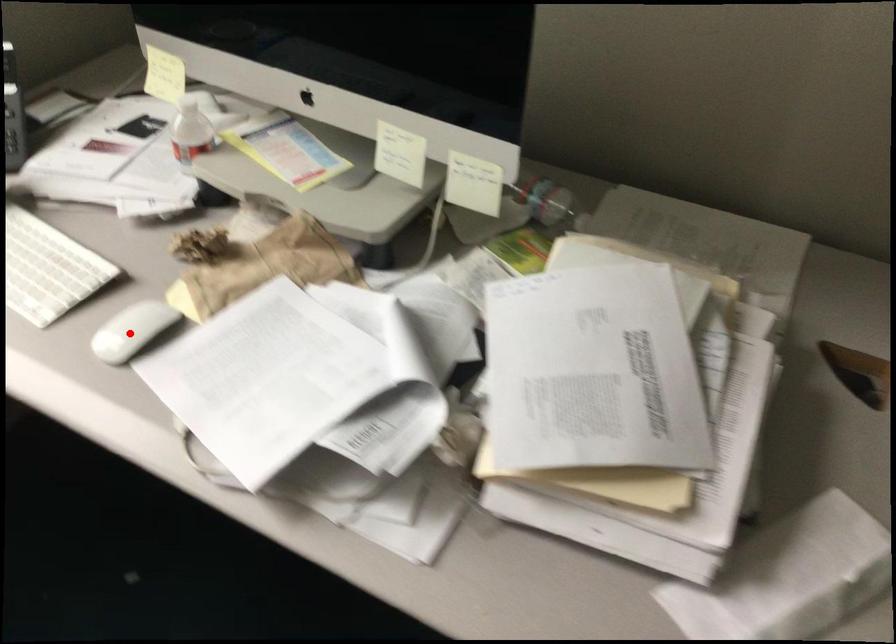
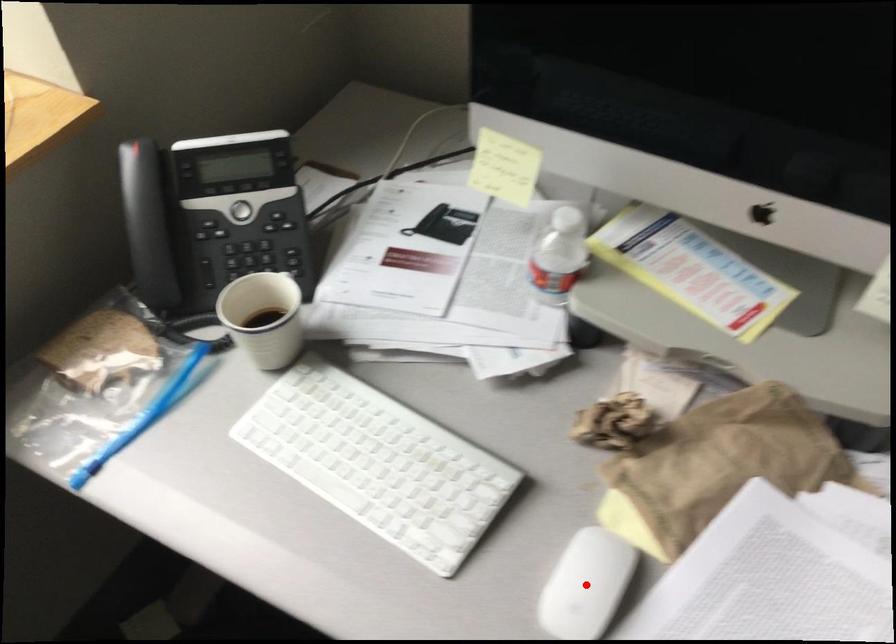
I am providing you with two images of the same scene from different viewpoints. A red point is marked on the first image and another point is marked on the second image. Is the red point in image1 aligned with the point shown in image2?

Yes